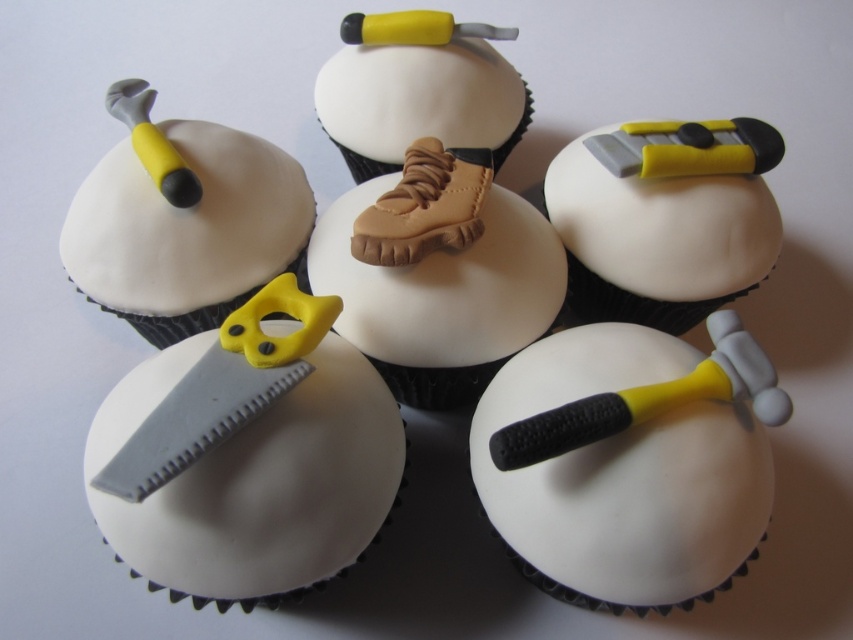
From the picture: Can you confirm if yellow matte hammer at lower right is taller than matte white shoe at center?

Indeed, yellow matte hammer at lower right has a greater height compared to matte white shoe at center.

Does point (505, 396) come behind point (347, 52)?

No, (505, 396) is closer to viewer.

Where is `yellow matte hammer at lower right`? The height and width of the screenshot is (640, 853). yellow matte hammer at lower right is located at coordinates (630, 461).

Between point (728, 312) and point (657, 323), which one is positioned in front?

Positioned in front is point (728, 312).

Is yellow matte hammer at lower right positioned behind matte gray hammer at center?

No.

This screenshot has height=640, width=853. In order to click on yellow matte hammer at lower right in this screenshot , I will do `click(630, 461)`.

At what (x,y) coordinates should I click in order to perform the action: click on yellow matte hammer at lower right. Please return your answer as a coordinate pair (x, y). The height and width of the screenshot is (640, 853). Looking at the image, I should click on (630, 461).

Is matte yellow plastic scissors at left to the left of matte gray hammer at center from the viewer's perspective?

Indeed, matte yellow plastic scissors at left is positioned on the left side of matte gray hammer at center.

Can you confirm if matte yellow plastic scissors at left is positioned to the right of matte gray hammer at center?

No, matte yellow plastic scissors at left is not to the right of matte gray hammer at center.

Does point (248, 182) come farther from viewer compared to point (602, 228)?

That is False.

You are a GUI agent. You are given a task and a screenshot of the screen. Output one action in this format:
    pyautogui.click(x=<x>, y=<y>)
    Task: Click on the matte yellow plastic scissors at left
    
    Given the screenshot: What is the action you would take?
    pyautogui.click(x=183, y=220)